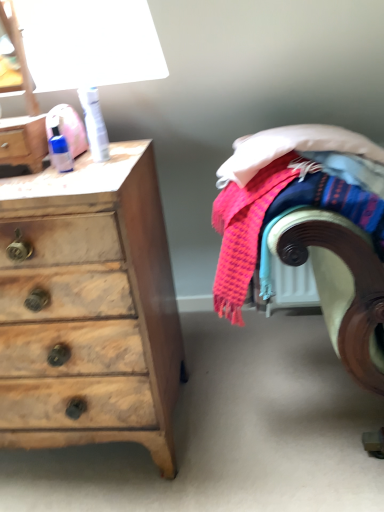
At what (x,y) coordinates should I click in order to perform the action: click on free location in front of matte plastic bottle at upper left. Please return your answer as a coordinate pair (x, y). Image resolution: width=384 pixels, height=512 pixels. Looking at the image, I should click on (35, 183).